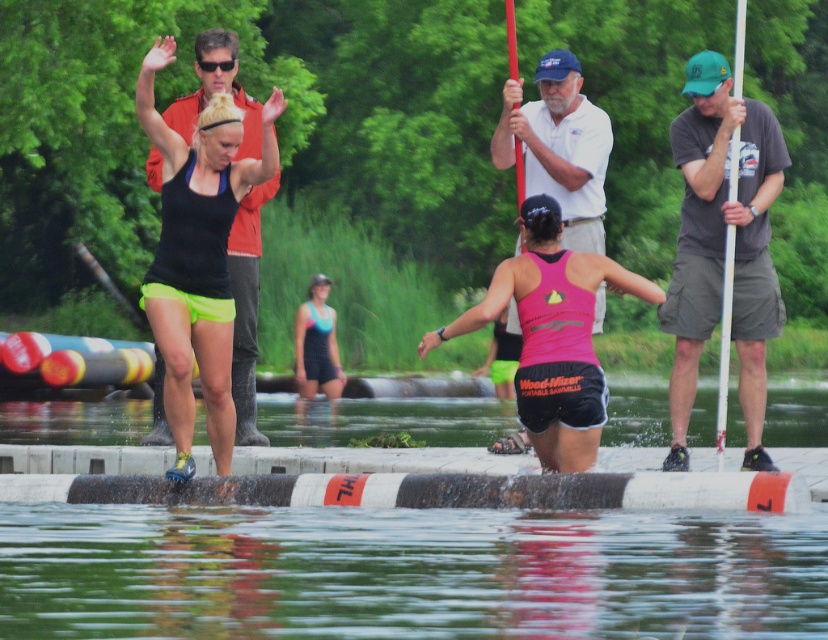
Which is below, gray cotton t-shirt at right or white cotton shirt at center?

Positioned lower is white cotton shirt at center.

What are the coordinates of `gray cotton t-shirt at right` in the screenshot? It's located at [x=721, y=248].

Where is `gray cotton t-shirt at right`? The height and width of the screenshot is (640, 828). gray cotton t-shirt at right is located at coordinates (721, 248).

Looking at this image, is white smooth water at lower center wider than white plastic pole at right?

Yes, white smooth water at lower center is wider than white plastic pole at right.

Which is more to the right, white smooth water at lower center or white plastic pole at right?

From the viewer's perspective, white plastic pole at right appears more on the right side.

The height and width of the screenshot is (640, 828). Identify the location of white smooth water at lower center. (383, 419).

Is gray cotton t-shirt at right thinner than pink matte tank top at center?

Yes, gray cotton t-shirt at right is thinner than pink matte tank top at center.

Can you confirm if gray cotton t-shirt at right is positioned to the right of pink matte tank top at center?

Yes, gray cotton t-shirt at right is to the right of pink matte tank top at center.

This screenshot has height=640, width=828. In order to click on gray cotton t-shirt at right in this screenshot , I will do `click(721, 248)`.

This screenshot has height=640, width=828. I want to click on gray cotton t-shirt at right, so click(721, 248).